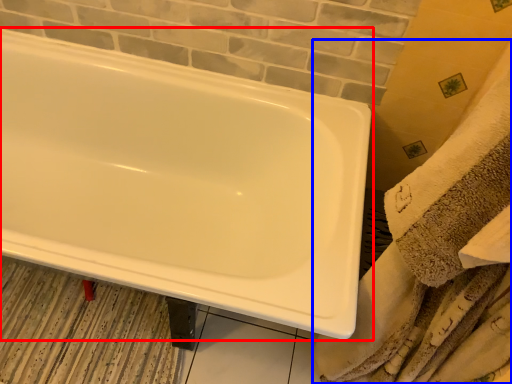
Question: Which object appears closest to the camera in this image, bathtub (highlighted by a red box) or bath towel (highlighted by a blue box)?

Choices:
 (A) bathtub
 (B) bath towel

Answer: (B)